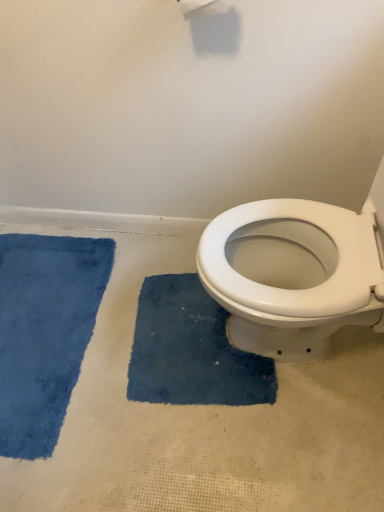
Question: In the image, is blue plush bath mat at left, which ranks as the first bath mat in left-to-right order, on the left side or the right side of blue plush bath mat at center, which appears as the 2th bath mat when viewed from the left?

Choices:
 (A) left
 (B) right

Answer: (A)

Question: From the image's perspective, is blue plush bath mat at left, placed as the second bath mat when sorted from right to left, above or below blue plush bath mat at center, the first bath mat positioned from the right?

Choices:
 (A) below
 (B) above

Answer: (B)

Question: Does point (3, 367) appear closer or farther from the camera than point (273, 367)?

Choices:
 (A) farther
 (B) closer

Answer: (A)

Question: In terms of height, does blue plush bath mat at center, the first bath mat positioned from the right, look taller or shorter compared to blue plush bath mat at left, which ranks as the first bath mat in left-to-right order?

Choices:
 (A) tall
 (B) short

Answer: (B)

Question: Does point (157, 324) appear closer or farther from the camera than point (59, 280)?

Choices:
 (A) closer
 (B) farther

Answer: (A)

Question: Is blue plush bath mat at center, the first bath mat positioned from the right, to the left or to the right of blue plush bath mat at left, placed as the second bath mat when sorted from right to left, in the image?

Choices:
 (A) right
 (B) left

Answer: (A)

Question: Is blue plush bath mat at center, which appears as the 2th bath mat when viewed from the left, in front of or behind blue plush bath mat at left, which ranks as the first bath mat in left-to-right order, in the image?

Choices:
 (A) behind
 (B) front

Answer: (A)